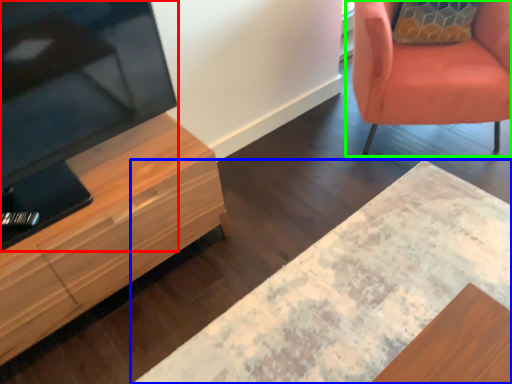
Question: Estimate the real-world distances between objects in this image. Which object is closer to television (highlighted by a red box), desk (highlighted by a blue box) or chair (highlighted by a green box)?

Choices:
 (A) desk
 (B) chair

Answer: (A)